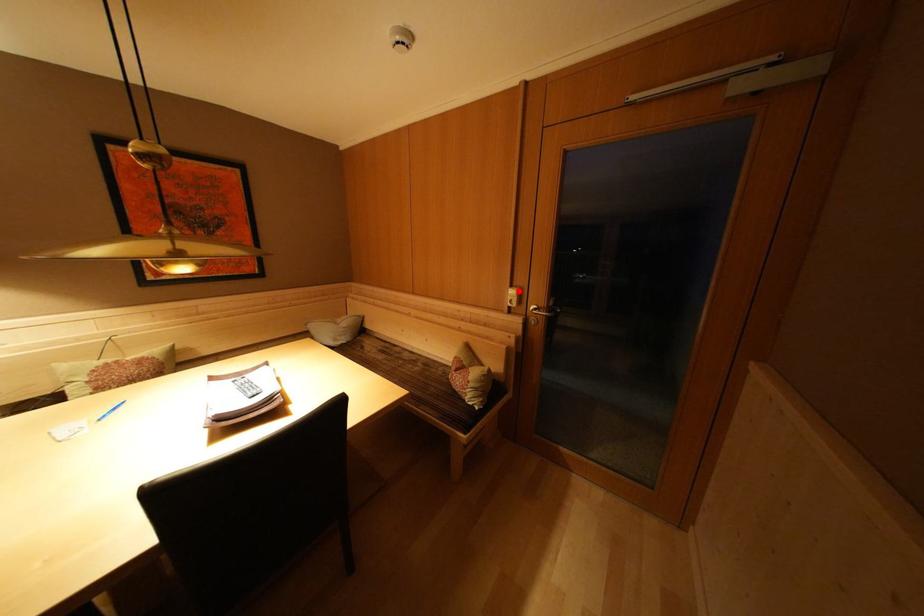
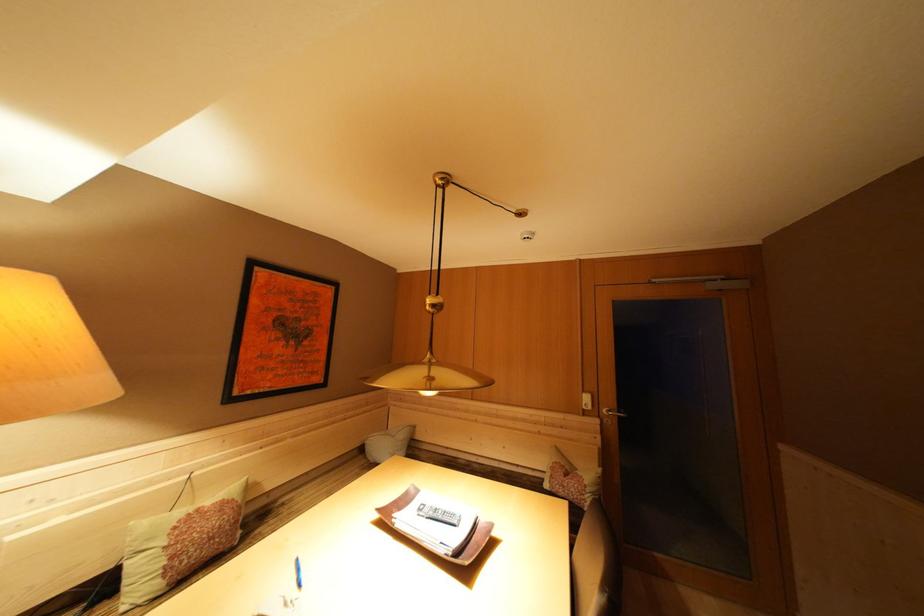
The point at the highlighted location is marked in the first image. Where is the corresponding point in the second image?

(590, 397)